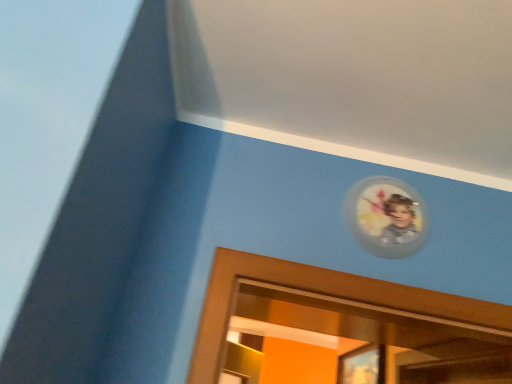
Question: Would you say transparent plastic picture frame at upper right is inside or outside matte wooden portrait at upper center?

Choices:
 (A) inside
 (B) outside

Answer: (B)

Question: From a real-world perspective, is transparent plastic picture frame at upper right positioned above or below matte wooden portrait at upper center?

Choices:
 (A) below
 (B) above

Answer: (B)

Question: Looking at the image, does transparent plastic picture frame at upper right seem bigger or smaller compared to matte wooden portrait at upper center?

Choices:
 (A) small
 (B) big

Answer: (A)

Question: From their relative heights in the image, would you say matte wooden portrait at upper center is taller or shorter than transparent plastic picture frame at upper right?

Choices:
 (A) tall
 (B) short

Answer: (B)

Question: Is matte wooden portrait at upper center to the left or to the right of transparent plastic picture frame at upper right in the image?

Choices:
 (A) left
 (B) right

Answer: (B)

Question: From the image's perspective, is matte wooden portrait at upper center above or below transparent plastic picture frame at upper right?

Choices:
 (A) below
 (B) above

Answer: (A)

Question: Is matte wooden portrait at upper center situated inside transparent plastic picture frame at upper right or outside?

Choices:
 (A) inside
 (B) outside

Answer: (B)